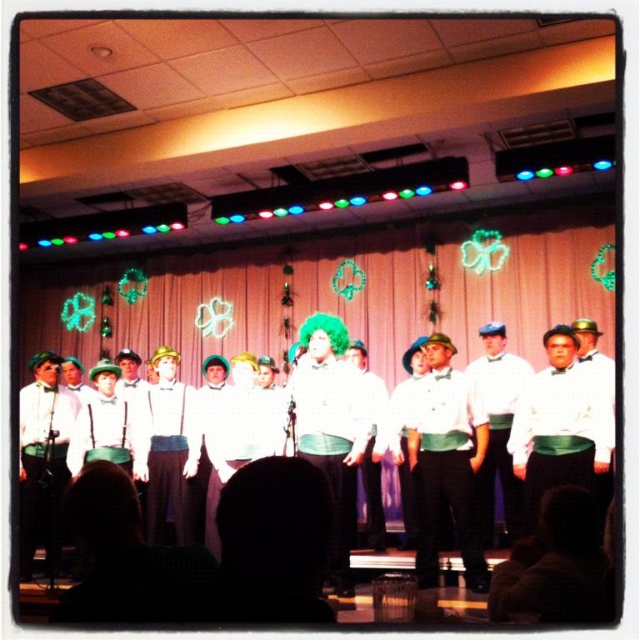
You are an audience member sitting in the front row of the stage. You notice two white shirts at center stage. Which one is positioned to the left between the white fabric shirt at center and the white matte shirt at center?

The white fabric shirt at center is positioned to the left of the white matte shirt at center.

You are a stage designer preparing for a performance. You need to ensure that the white satin bow tie at center and the white matte shirt at center are visible to the audience. Given their sizes, which one might require additional lighting to stand out?

The white satin bow tie at center has a smaller width compared to the white matte shirt at center, so it might require additional lighting to ensure visibility.

You are a photographer setting up for the performance. You need to focus your camera on the white satin bow tie at center and the white matte shirt at center. Which object should you adjust the focus to first if you want to capture both clearly in the same frame?

The white satin bow tie at center is smaller than the white matte shirt at center, so you should focus on the smaller object first to ensure it is sharp before adjusting for the larger one.